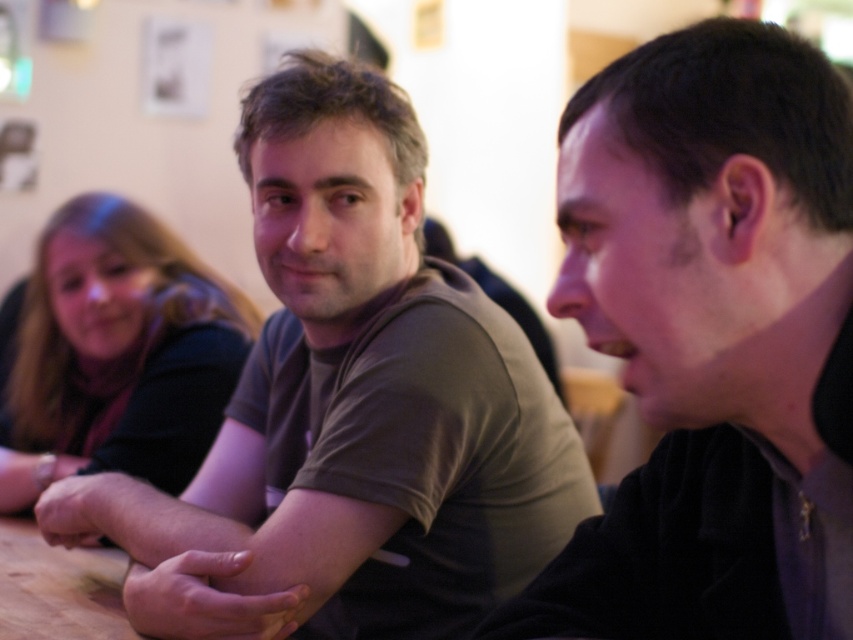
Question: Among these points, which one is nearest to the camera?

Choices:
 (A) (27, 548)
 (B) (664, 61)
 (C) (286, 307)
 (D) (108, 275)

Answer: (B)

Question: Based on their relative distances, which object is farther from the brown matte shirt at center?

Choices:
 (A) matte black shirt at upper left
 (B) wooden at lower left

Answer: (A)

Question: Does brown matte shirt at center lie behind black matte shirt at center?

Choices:
 (A) no
 (B) yes

Answer: (B)

Question: Where is black matte shirt at center located in relation to matte black shirt at upper left in the image?

Choices:
 (A) above
 (B) below

Answer: (A)

Question: Which object appears closest to the camera in this image?

Choices:
 (A) wooden at lower left
 (B) black matte shirt at center

Answer: (B)

Question: Does matte black shirt at upper left have a smaller size compared to wooden at lower left?

Choices:
 (A) yes
 (B) no

Answer: (B)